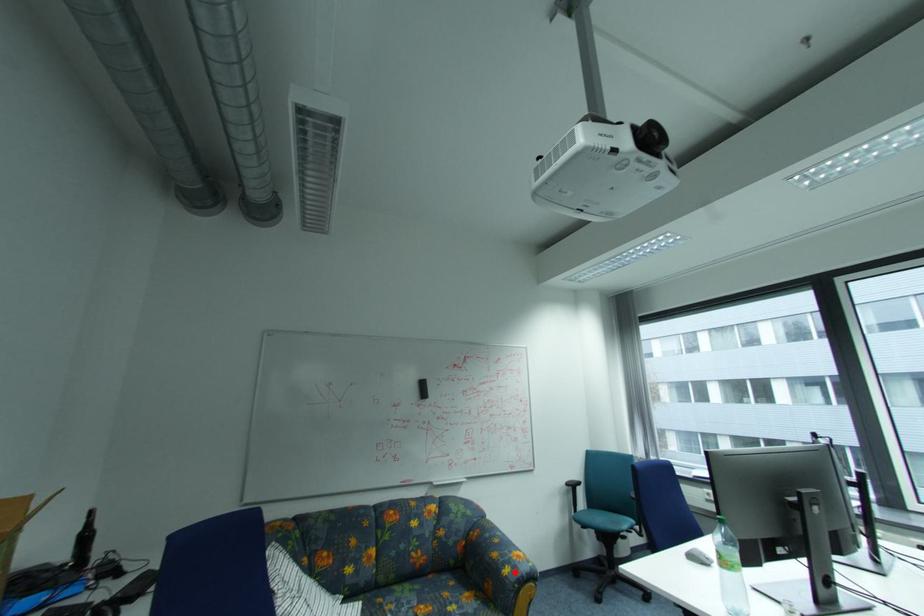
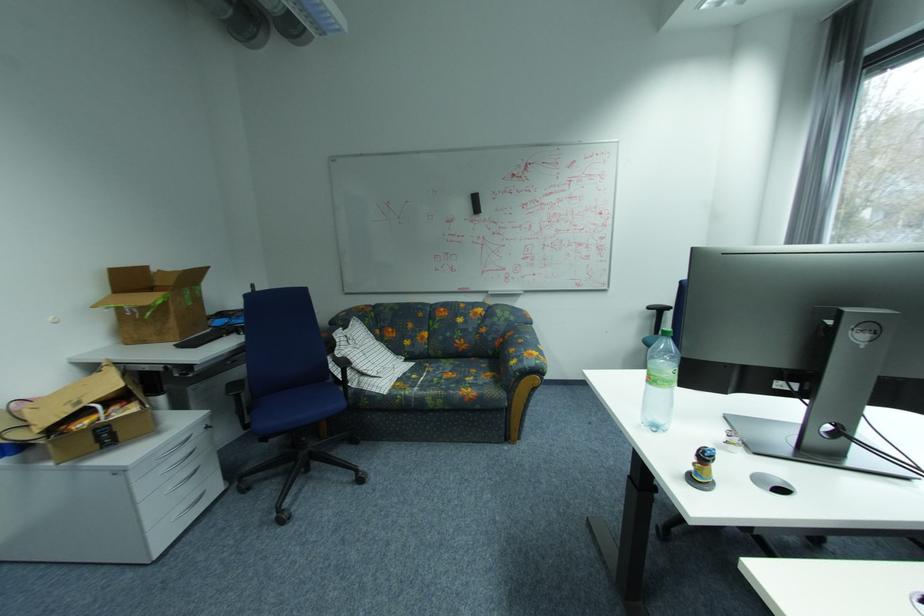
In the second image, find the point that corresponds to the highlighted location in the first image.

(521, 363)